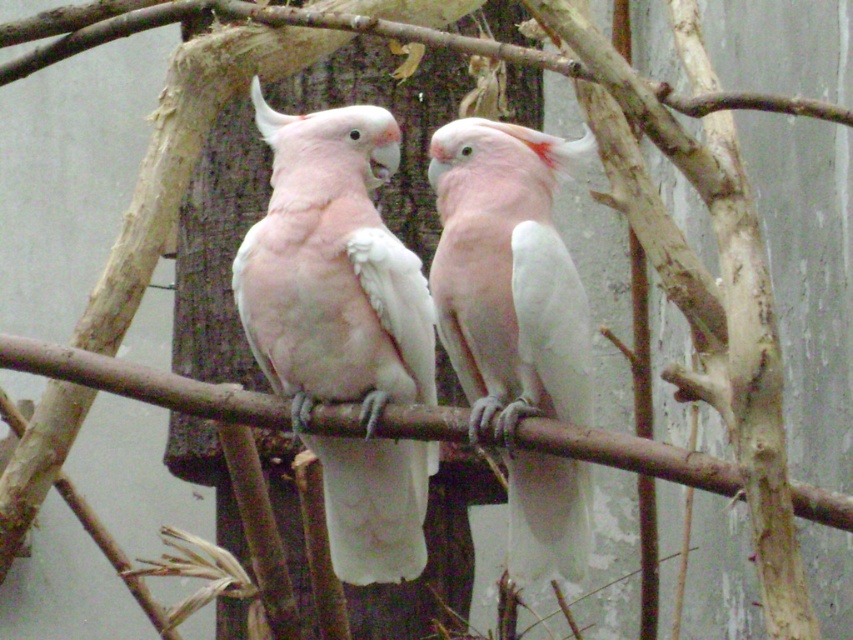
Question: Is pink feathered parrot at center below white feathered parrot at center?

Choices:
 (A) yes
 (B) no

Answer: (B)

Question: Which point is farther to the camera?

Choices:
 (A) (546, 164)
 (B) (378, 108)

Answer: (B)

Question: Considering the relative positions of pink feathered parrot at center and white feathered parrot at center in the image provided, where is pink feathered parrot at center located with respect to white feathered parrot at center?

Choices:
 (A) right
 (B) left

Answer: (B)

Question: Is pink feathered parrot at center wider than white feathered parrot at center?

Choices:
 (A) no
 (B) yes

Answer: (B)

Question: Which object appears farthest from the camera in this image?

Choices:
 (A) pink feathered parrot at center
 (B) white feathered parrot at center

Answer: (A)